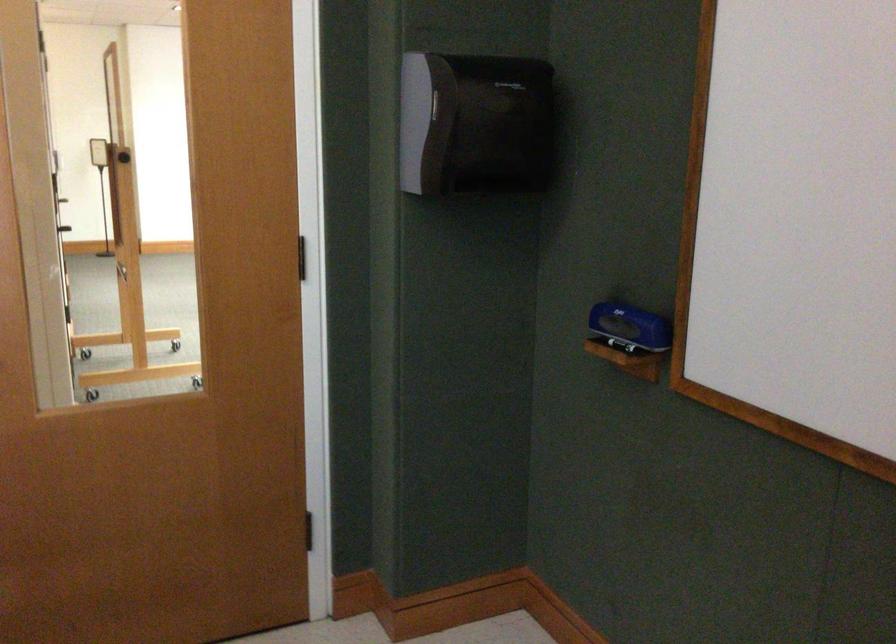
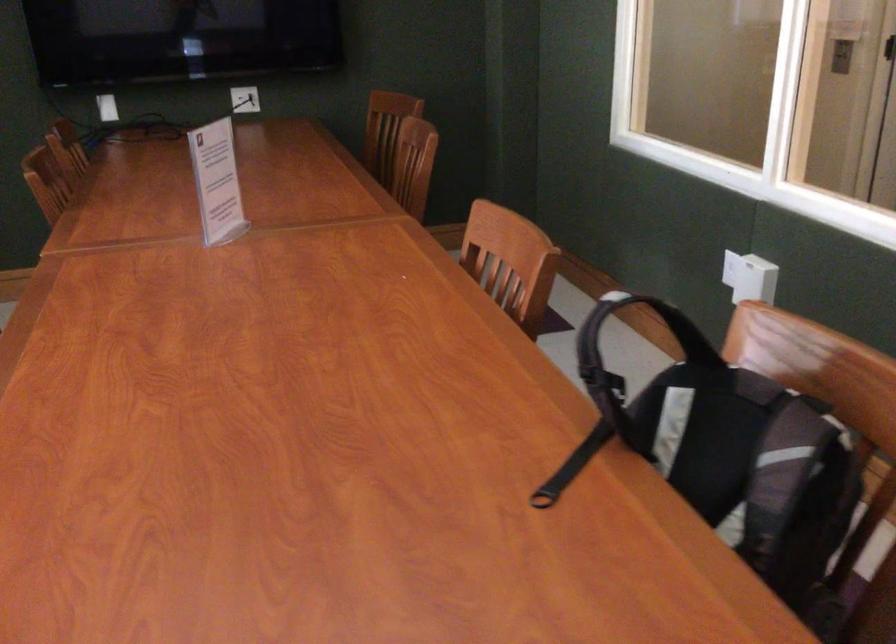
In the scene shown: Based on the continuous images, in which direction is the camera rotating?

The rotation direction of the camera is left-down.